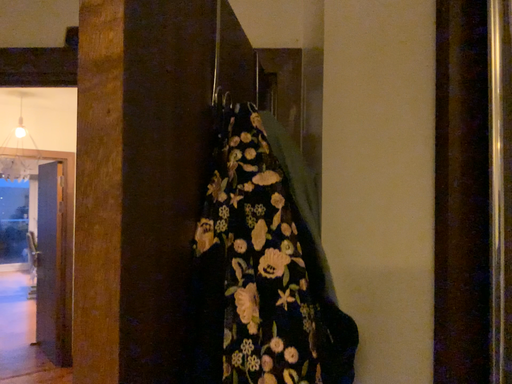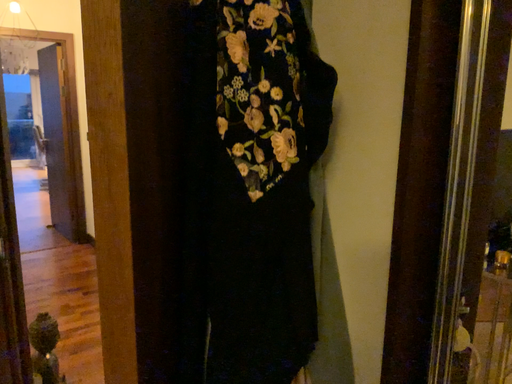
Question: Which way did the camera rotate in the video?

Choices:
 (A) rotated upward
 (B) rotated downward

Answer: (B)